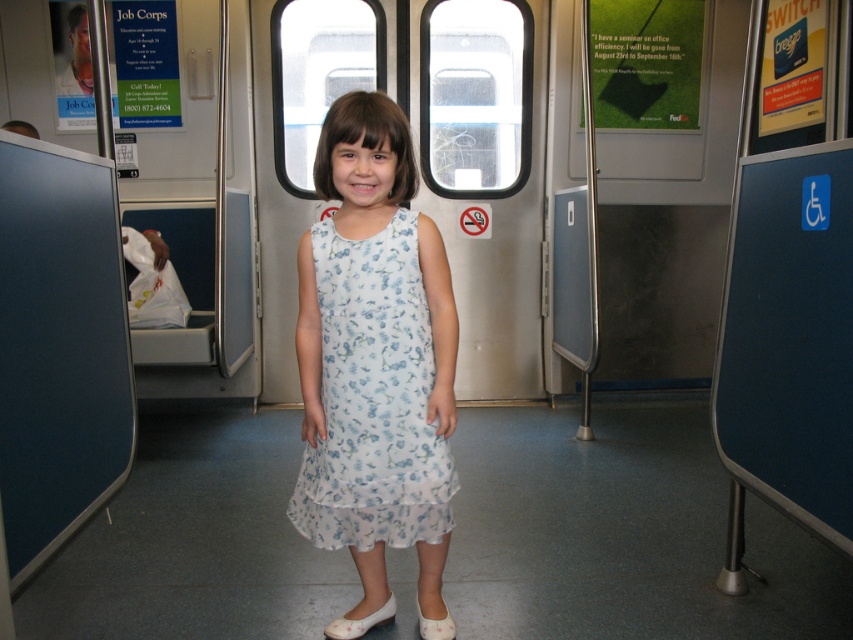
You are a photographer taking a closeup shot of the shoes in the image. Which shoe, the white satin shoe at lower center or the white fabric shoe at lower center, is located to the left?

The white satin shoe at lower center is positioned on the left side of the white fabric shoe at lower center.

You are standing inside a public transportation vehicle and want to reach a specific point marked at coordinates point (437, 493). If your current position allows you to reach objects within 6 feet, can you comfortably reach that point?

The distance of point (437, 493) from viewer is 6.05 feet, which is slightly beyond your comfortable reach of 6 feet. You may need to take a small step forward to reach it.

You are a photographer positioned at the origin point of the coordinate system. You want to capture a photo of the white floral dress at center. What are the coordinates where you should aim your camera?

The coordinates to aim the camera are at point 0.623 in the x direction and 0.438 in the y direction, as the white floral dress at center is located there.